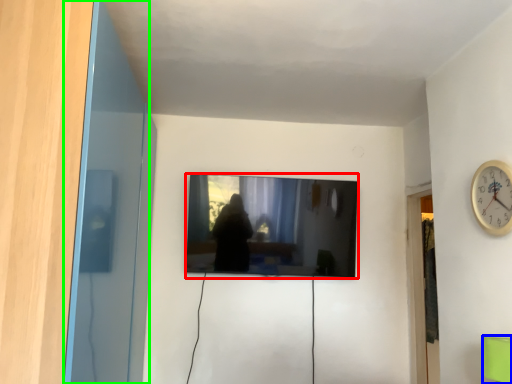
Question: Considering the real-world distances, which object is closest to television (highlighted by a red box)? furniture (highlighted by a blue box) or glass door (highlighted by a green box).

Choices:
 (A) furniture
 (B) glass door

Answer: (B)